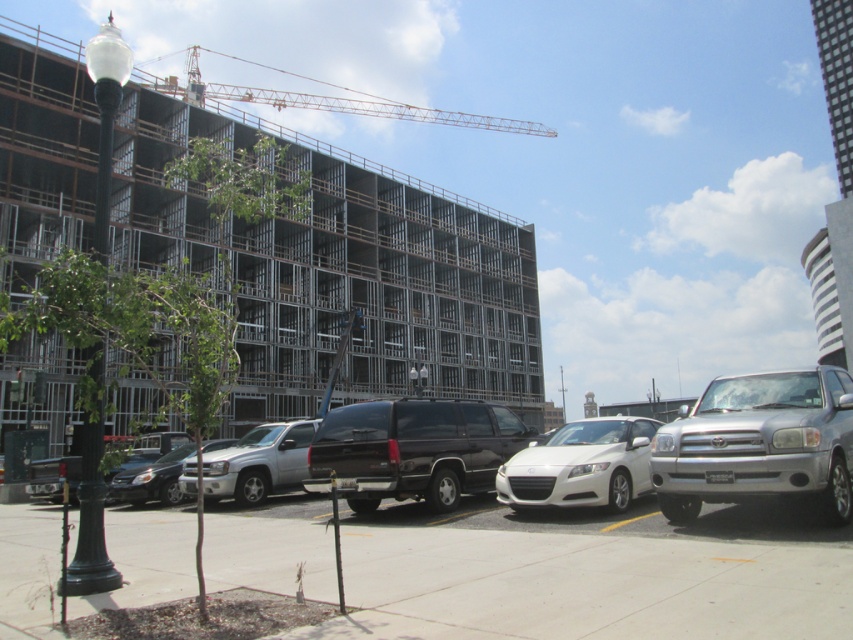
Identify the location of metallic red crane at upper center. (337, 102).

Does metallic red crane at upper center lie behind shiny silver sedan at lower left?

Yes, it is behind shiny silver sedan at lower left.

The width and height of the screenshot is (853, 640). What do you see at coordinates (337, 102) in the screenshot? I see `metallic red crane at upper center` at bounding box center [337, 102].

In order to click on metallic red crane at upper center in this screenshot , I will do `click(337, 102)`.

Between point (790, 451) and point (409, 465), which one is positioned in front?

Positioned in front is point (790, 451).

Between silver metallic suv at right and shiny black suv at center, which one appears on the right side from the viewer's perspective?

Positioned to the right is silver metallic suv at right.

Between point (659, 464) and point (352, 500), which one is positioned behind?

Point (352, 500)

The height and width of the screenshot is (640, 853). Identify the location of silver metallic suv at right. (759, 444).

Who is shorter, metal frame building at upper left or metallic red crane at upper center?

metallic red crane at upper center

Based on the photo, does metal frame building at upper left have a greater height compared to metallic red crane at upper center?

Indeed, metal frame building at upper left has a greater height compared to metallic red crane at upper center.

Find the location of a particular element. metal frame building at upper left is located at coordinates (335, 268).

Image resolution: width=853 pixels, height=640 pixels. What are the coordinates of `metal frame building at upper left` in the screenshot? It's located at (335, 268).